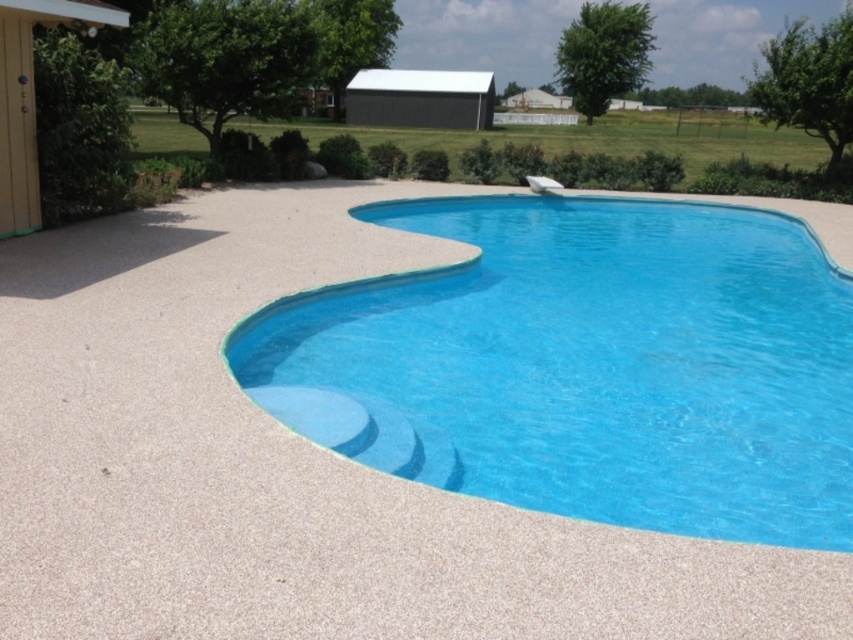
You are standing in the backyard and want to take a shortcut to the shed. You see the clear blue pool at center and the green grass at upper center. Which path would be shorter if you walk between them?

The clear blue pool at center is in front of green grass at upper center, so walking towards the clear blue pool at center would be the shorter path since it is closer to you.

You are standing in the backyard looking at the swimming pool. There are two points marked in the image. Which of the two points, point (x=469, y=372) or point (x=383, y=132), is closer to you?

Point (x=469, y=372) is closer to you than point (x=383, y=132).

You are standing in the backyard and want to walk from the green grass at upper center to the clear blue pool at center. Which direction should you move to reach the pool?

The clear blue pool at center is to the left of green grass at upper center, so you should move to your left to reach the pool.